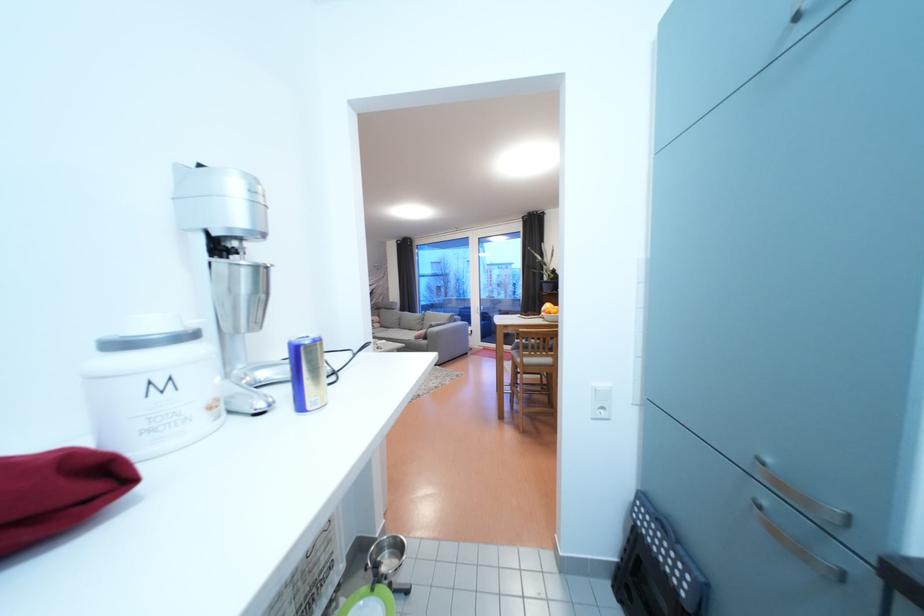
Where would you lift the metal mixer cup? Please return your answer as a coordinate pair (x, y).

(386, 554)